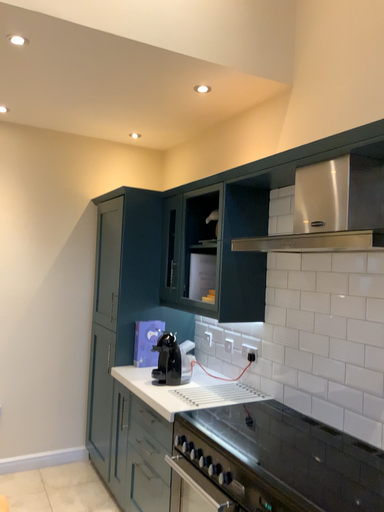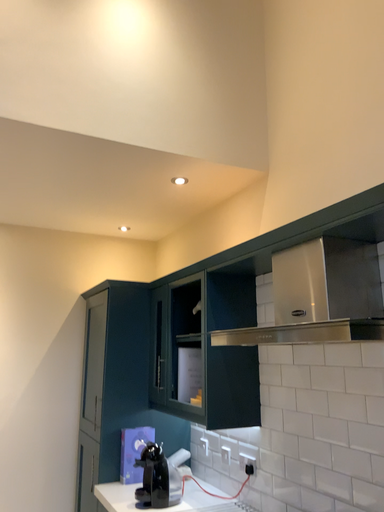
Question: Which way did the camera rotate in the video?

Choices:
 (A) rotated downward
 (B) rotated upward

Answer: (B)